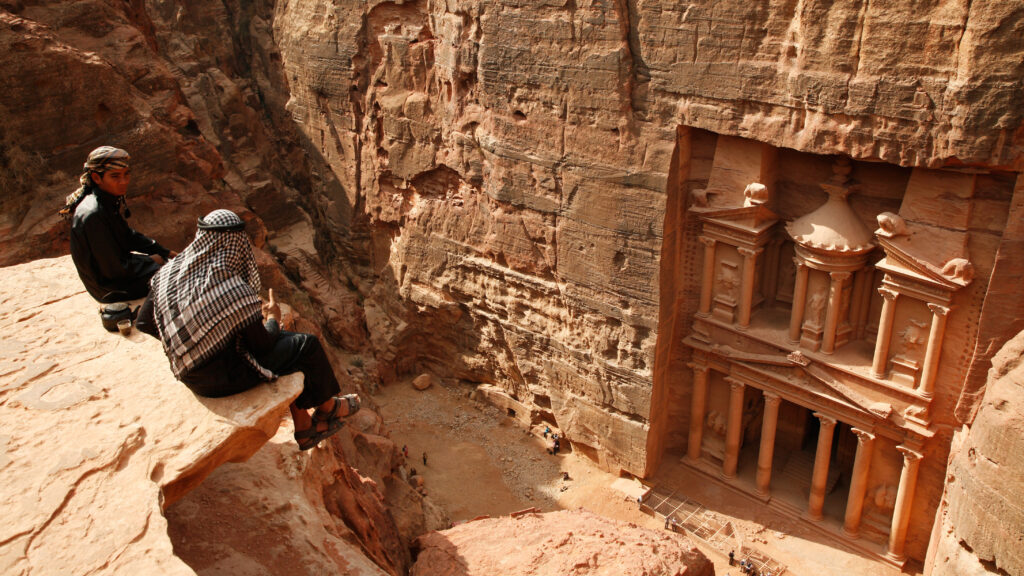
The width and height of the screenshot is (1024, 576). Find the location of `cup`. cup is located at coordinates (127, 332).